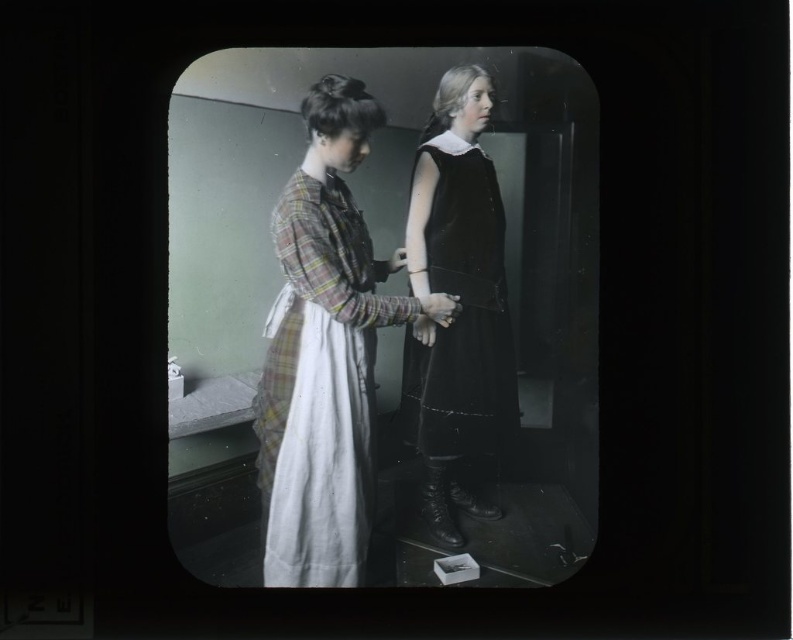
Which is in front, point (362, 390) or point (454, 304)?

Point (362, 390)

Which of these two, plaid fabric dress at center or smooth white glove at center, stands taller?

Standing taller between the two is plaid fabric dress at center.

Is point (290, 540) positioned in front of point (435, 308)?

Yes.

Where is `plaid fabric dress at center`? The image size is (793, 640). plaid fabric dress at center is located at coordinates (322, 353).

Is velvet black dress at center shorter than smooth white glove at center?

In fact, velvet black dress at center may be taller than smooth white glove at center.

Between velvet black dress at center and smooth white glove at center, which one appears on the right side from the viewer's perspective?

velvet black dress at center

Is point (479, 237) positioned after point (427, 300)?

No, it is not.

Locate an element on the screen. This screenshot has width=793, height=640. velvet black dress at center is located at coordinates (462, 317).

Does point (305, 262) lie behind point (511, 348)?

No.

Is plaid fabric dress at center in front of velvet black dress at center?

Yes, plaid fabric dress at center is in front of velvet black dress at center.

What do you see at coordinates (322, 353) in the screenshot? The image size is (793, 640). I see `plaid fabric dress at center` at bounding box center [322, 353].

Find the location of a particular element. plaid fabric dress at center is located at coordinates (322, 353).